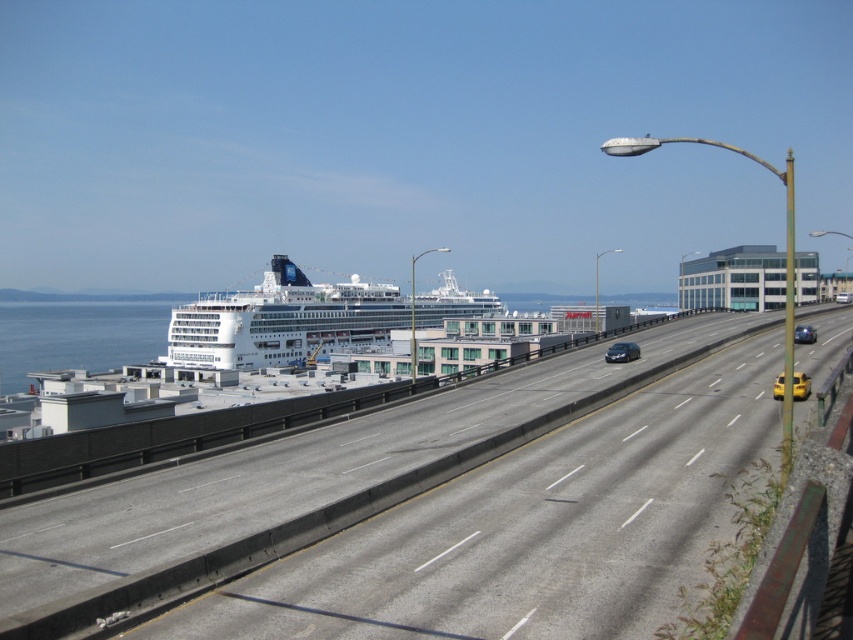
You are a drone operator trying to capture a photo of the gray asphalt highway at center from above. What are the coordinates where you should position the drone to ensure it is directly above the highway?

The coordinates for the gray asphalt highway at center are at point (306, 481), so the drone should be positioned at those coordinates to be directly above it.

Consider the image. You are a delivery driver who needs to pick up a package from the yellow matte taxi cab at center right. The taxi is at point (799, 385). The pickup location is at point 0.5, 0.5. Can you reach the taxi from your current position without crossing any lanes?

The yellow matte taxi cab at center right is located at point (799, 385). Since your current position is at 0.5, 0.5, you would need to move towards the taxi while staying within your lane. However, without knowing the exact lane configuration or the path between the two points, it is uncertain if crossing lanes is necessary. Please check the road layout for safe navigation.

You are a photographer standing on the waterfront and want to capture both the white glossy cruise ship at center and the yellow matte taxi at right in a single photo. However, your camera has a limited zoom range. Based on their sizes, which object should you focus on first to ensure both are in frame?

The white glossy cruise ship at center is taller than the yellow matte taxi at right, so you should focus on the cruise ship first to ensure both are in frame.